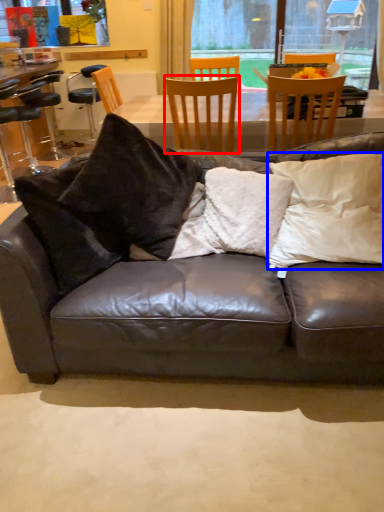
Question: Which of the following is the farthest to the observer, chair (highlighted by a red box) or pillow (highlighted by a blue box)?

Choices:
 (A) chair
 (B) pillow

Answer: (A)